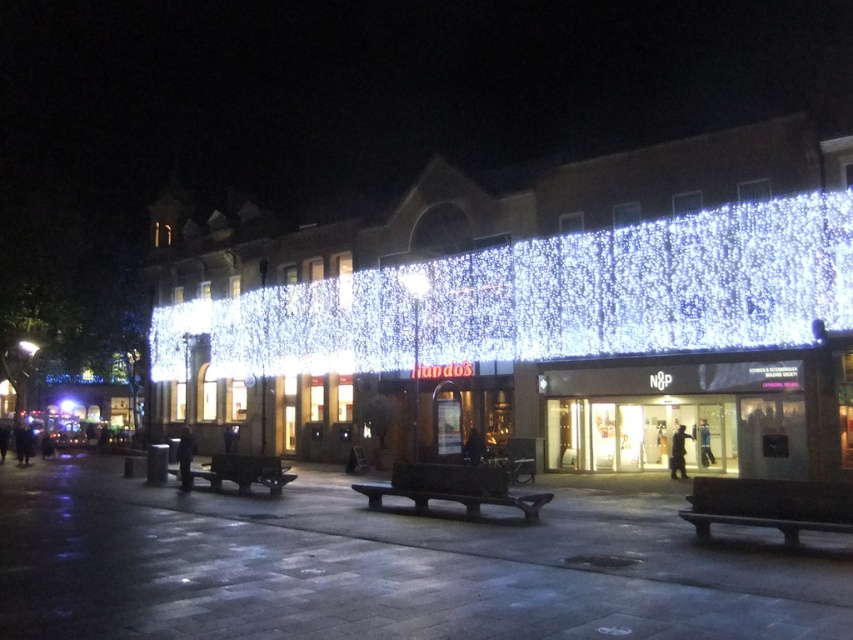
In the scene shown: You are standing on the street and want to sit down on the smooth concrete benches at center. Which direction should you walk to reach them from the illuminated glass facade at center?

The illuminated glass facade at center is to the right of the smooth concrete benches at center, so you should walk to the left to reach the smooth concrete benches at center from the illuminated glass facade at center.